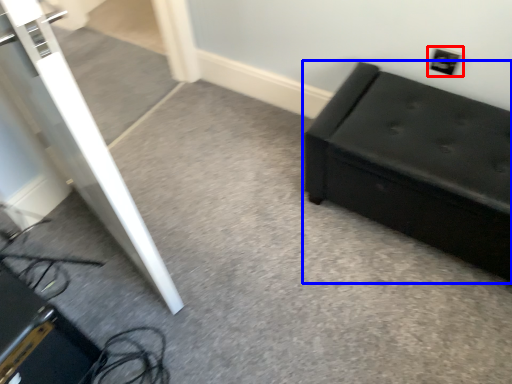
Question: Which object is closer to the camera taking this photo, electric outlet (highlighted by a red box) or furniture (highlighted by a blue box)?

Choices:
 (A) electric outlet
 (B) furniture

Answer: (B)